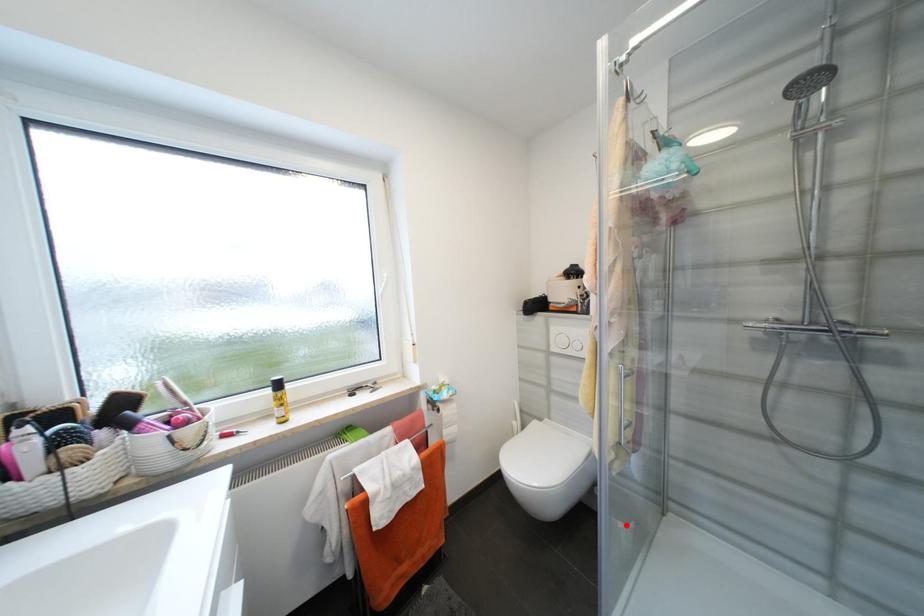
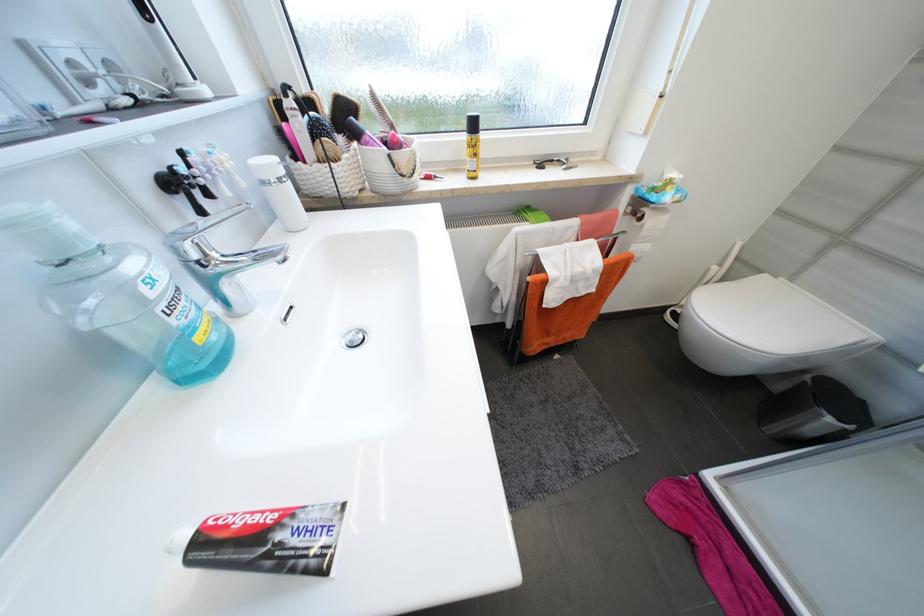
Question: A red point is marked in image1. In image2, is the corresponding 3D point closer to the camera or farther? Reply with the corresponding letter.

Choices:
 (A) The corresponding 3D point is closer.
 (B) The corresponding 3D point is farther.

Answer: (A)